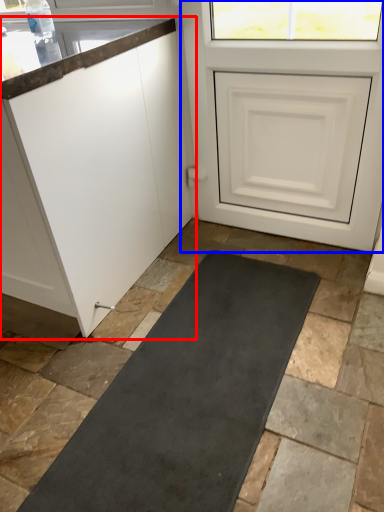
Question: Which object is further to the camera taking this photo, cabinetry (highlighted by a red box) or door (highlighted by a blue box)?

Choices:
 (A) cabinetry
 (B) door

Answer: (B)